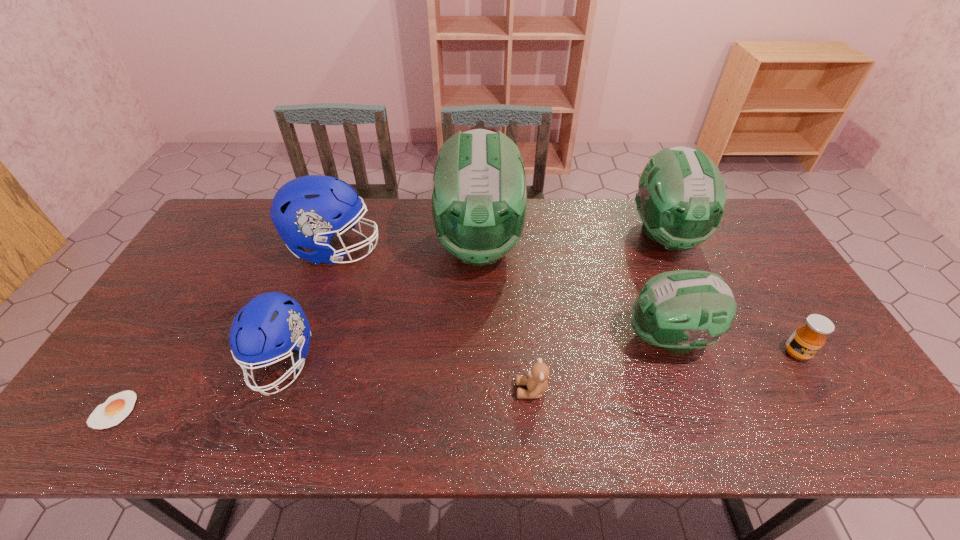
Where is `vacant space that's between the smallest green football helmet and the second shortest object`? The image size is (960, 540). vacant space that's between the smallest green football helmet and the second shortest object is located at coordinates (600, 364).

I want to click on free space between the farther blue football helmet and the brown teddy bear, so click(433, 320).

Locate an element on the screen. The height and width of the screenshot is (540, 960). blank region between the farther blue football helmet and the leftmost object is located at coordinates (225, 329).

Identify the location of object that stands as the third closest to the smaller blue football helmet. This screenshot has width=960, height=540. (479, 195).

Locate which object ranks second in proximity to the shortest object. Please provide its 2D coordinates. Your answer should be formatted as a tuple, i.e. [(x, y)], where the tuple contains the x and y coordinates of a point satisfying the conditions above.

[(308, 211)]

Point out which football helmet is positioned as the nearest to the tallest object. Please provide its 2D coordinates. Your answer should be formatted as a tuple, i.e. [(x, y)], where the tuple contains the x and y coordinates of a point satisfying the conditions above.

[(308, 211)]

Locate an element on the screen. Image resolution: width=960 pixels, height=540 pixels. football helmet identified as the second closest to the orange honey is located at coordinates (681, 197).

Identify which green football helmet is the third nearest to the farther blue football helmet. Please provide its 2D coordinates. Your answer should be formatted as a tuple, i.e. [(x, y)], where the tuple contains the x and y coordinates of a point satisfying the conditions above.

[(681, 197)]

Identify which green football helmet is the third nearest to the nearer blue football helmet. Please provide its 2D coordinates. Your answer should be formatted as a tuple, i.e. [(x, y)], where the tuple contains the x and y coordinates of a point satisfying the conditions above.

[(681, 197)]